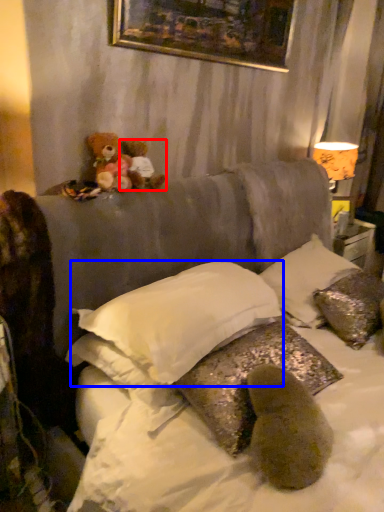
Question: Among these objects, which one is nearest to the camera, teddy bear (highlighted by a red box) or pillow (highlighted by a blue box)?

Choices:
 (A) teddy bear
 (B) pillow

Answer: (B)